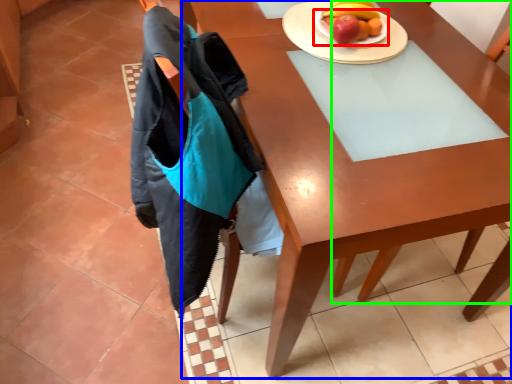
Question: Considering the real-world distances, which object is farthest from plate (highlighted by a red box)? desk (highlighted by a blue box) or chair (highlighted by a green box)?

Choices:
 (A) desk
 (B) chair

Answer: (A)